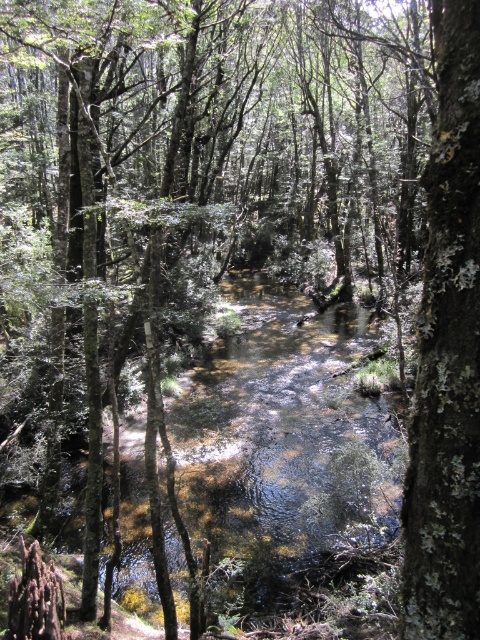
Is clear water at center wider than lichen-covered bark tree at center-right?

Yes, clear water at center is wider than lichen-covered bark tree at center-right.

Is point (271, 548) positioned before point (479, 371)?

No, it is not.

At what (x,y) coordinates should I click in order to perform the action: click on clear water at center. Please return your answer as a coordinate pair (x, y). The image size is (480, 640). Looking at the image, I should click on (290, 461).